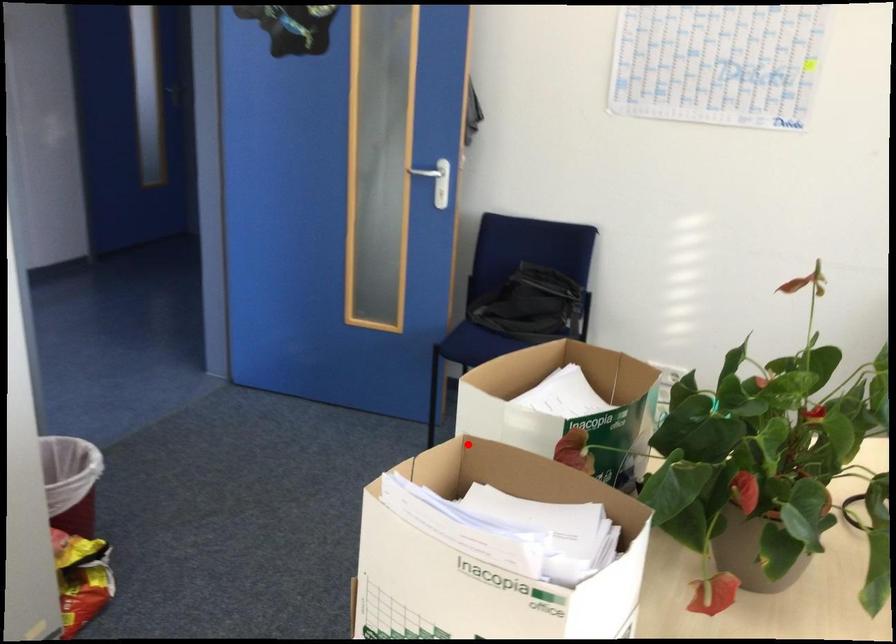
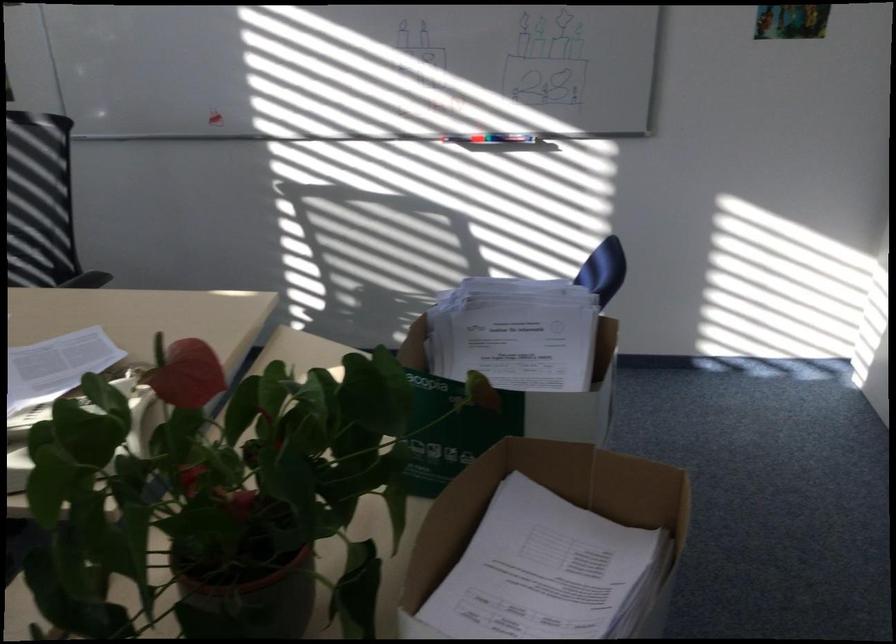
Question: I am providing you with two images of the same scene from different viewpoints. A red point is shown in image1. For the corresponding object point in image2, is it positioned nearer or farther from the camera?

Choices:
 (A) Nearer
 (B) Farther

Answer: (A)